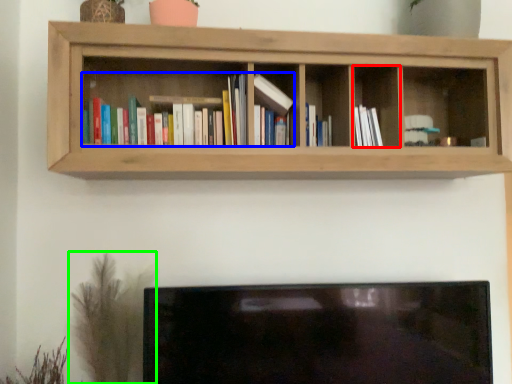
Question: Considering the real-world distances, which object is closest to cabinet (highlighted by a red box)? book (highlighted by a blue box) or plant (highlighted by a green box).

Choices:
 (A) book
 (B) plant

Answer: (A)